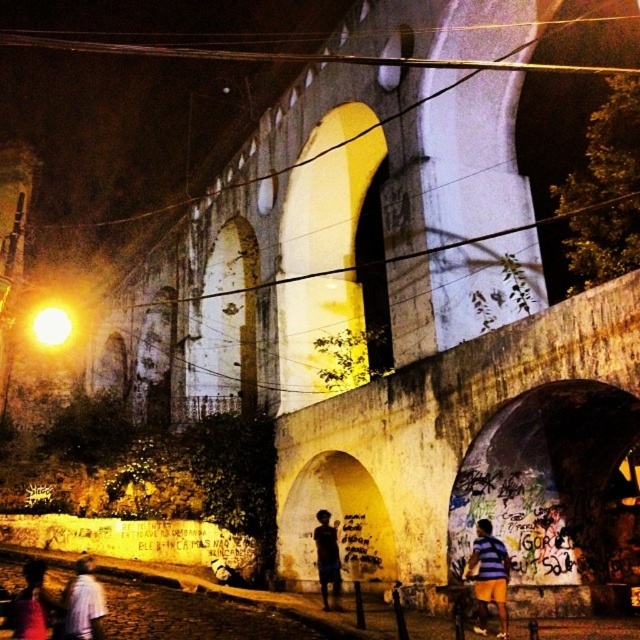
Who is more distant from viewer, [595,572] or [80,612]?

The point [595,572] is behind.

Who is more distant from viewer, (381,548) or (99,636)?

The point (381,548) is behind.

What are the coordinates of `yellow concrete wall at center` in the screenshot? It's located at (474, 456).

Can you confirm if matte pink shirt at lower left is smaller than dark skin textured shirt at center?

Actually, matte pink shirt at lower left might be larger than dark skin textured shirt at center.

Is matte pink shirt at lower left below dark skin textured shirt at center?

Indeed, matte pink shirt at lower left is positioned under dark skin textured shirt at center.

Between point (45, 625) and point (317, 548), which one is positioned behind?

Positioned behind is point (317, 548).

You are a GUI agent. You are given a task and a screenshot of the screen. Output one action in this format:
    pyautogui.click(x=<x>, y=<y>)
    Task: Click on the matte pink shirt at lower left
    The width and height of the screenshot is (640, 640).
    Given the screenshot: What is the action you would take?
    pyautogui.click(x=29, y=604)

What do you see at coordinates (83, 604) in the screenshot?
I see `white cotton shirt at lower left` at bounding box center [83, 604].

Can you confirm if white cotton shirt at lower left is smaller than matte pink shirt at lower left?

Correct, white cotton shirt at lower left occupies less space than matte pink shirt at lower left.

Is point (88, 563) positioned in front of point (38, 625)?

No, it is behind (38, 625).

Where is `white cotton shirt at lower left`? white cotton shirt at lower left is located at coordinates (83, 604).